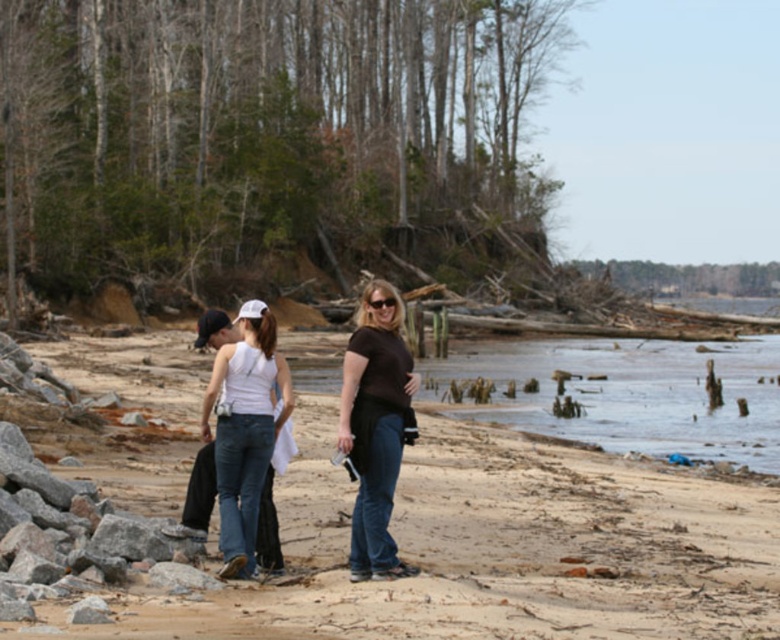
Question: Is brown sandy beach at center to the left of brown muddy water at lower right from the viewer's perspective?

Choices:
 (A) yes
 (B) no

Answer: (A)

Question: Which of the following is the closest to the observer?

Choices:
 (A) (562, 506)
 (B) (268, 428)
 (C) (596, 422)
 (D) (363, 451)

Answer: (D)

Question: Among these objects, which one is nearest to the camera?

Choices:
 (A) white denim jeans at center
 (B) brown sandy beach at center
 (C) brown muddy water at lower right
 (D) matte brown shirt at center

Answer: (B)

Question: Which of these objects is positioned closest to the white denim jeans at center?

Choices:
 (A) brown sandy beach at center
 (B) matte brown shirt at center

Answer: (B)

Question: Can you confirm if brown sandy beach at center is smaller than matte brown shirt at center?

Choices:
 (A) yes
 (B) no

Answer: (B)

Question: Does matte brown shirt at center lie in front of white denim jeans at center?

Choices:
 (A) no
 (B) yes

Answer: (B)